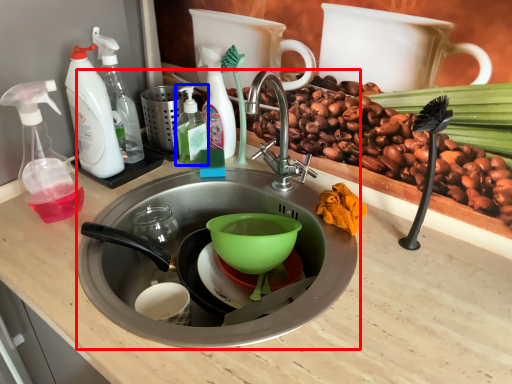
Question: Which of the following is the closest to the observer, sink (highlighted by a red box) or bottle (highlighted by a blue box)?

Choices:
 (A) sink
 (B) bottle

Answer: (A)